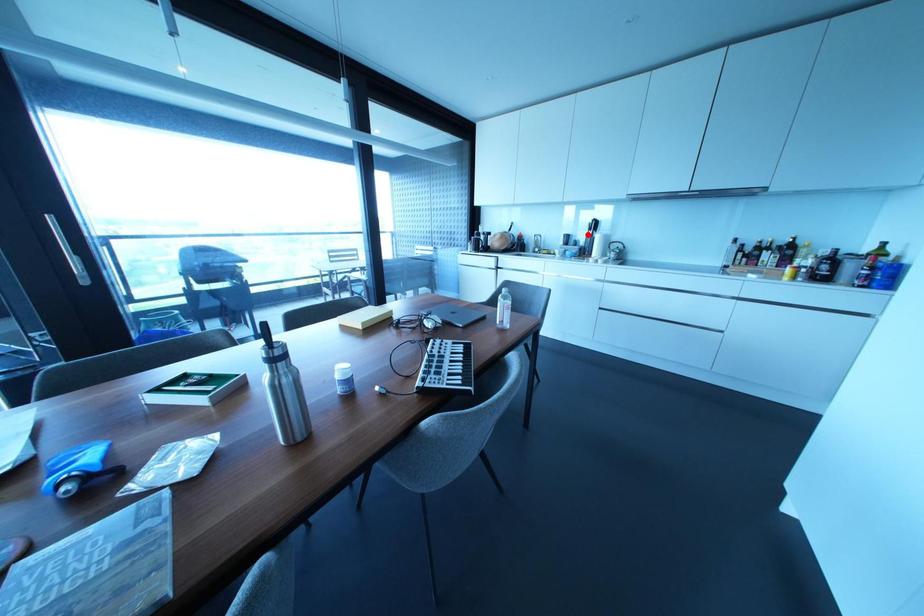
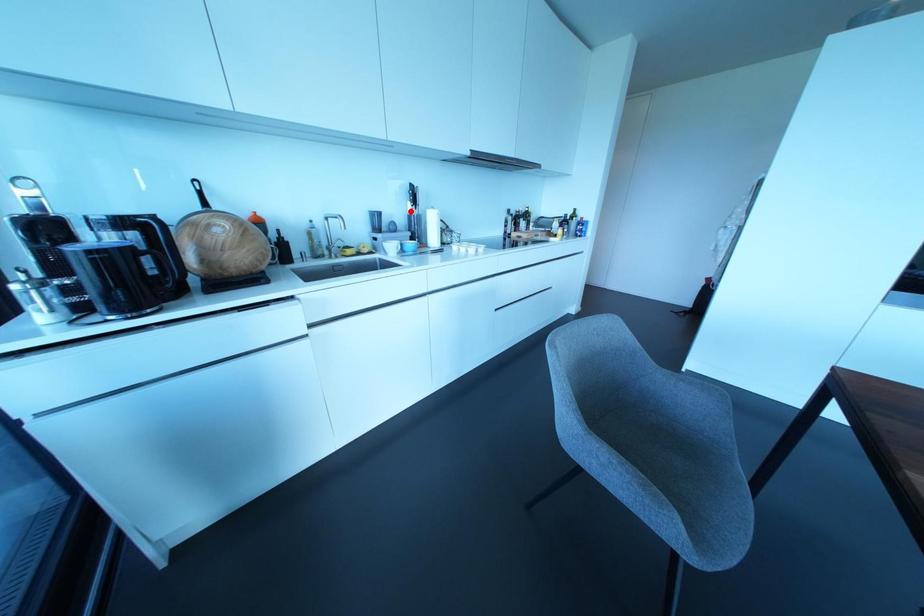
I am providing you with two images of the same scene from different viewpoints. A red point is marked on the first image and another point is marked on the second image. Does the point marked in image1 correspond to the same location as the one in image2?

Yes